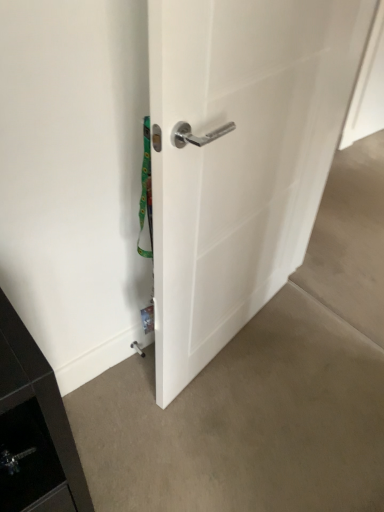
Question: In terms of height, does light brown carpet at lower center, which is the first concrete in bottom-to-top order, look taller or shorter compared to white glossy door handle at center?

Choices:
 (A) short
 (B) tall

Answer: (A)

Question: Is light brown carpet at lower center, which is the first concrete in bottom-to-top order, wider or thinner than white glossy door handle at center?

Choices:
 (A) thin
 (B) wide

Answer: (B)

Question: Estimate the real-world distances between objects in this image. Which object is farther from the light brown carpet at lower center, which is the first concrete in bottom-to-top order?

Choices:
 (A) white glossy door handle at center
 (B) smooth concrete floor at lower right, the 1th concrete in the top-to-bottom sequence

Answer: (B)

Question: Which of these objects is positioned farthest from the smooth concrete floor at lower right, the 1th concrete in the top-to-bottom sequence?

Choices:
 (A) white glossy door handle at center
 (B) light brown carpet at lower center, which appears as the 2th concrete when viewed from the top

Answer: (A)